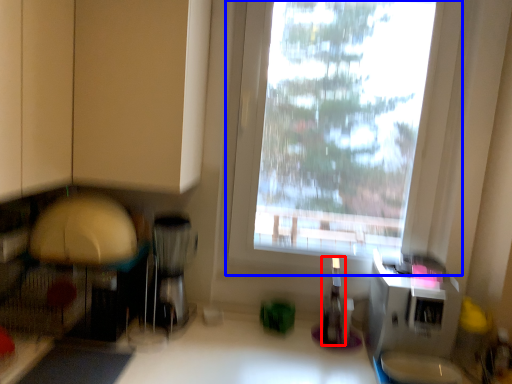
Question: Which object appears farthest to the camera in this image, bottle (highlighted by a red box) or window (highlighted by a blue box)?

Choices:
 (A) bottle
 (B) window

Answer: (A)